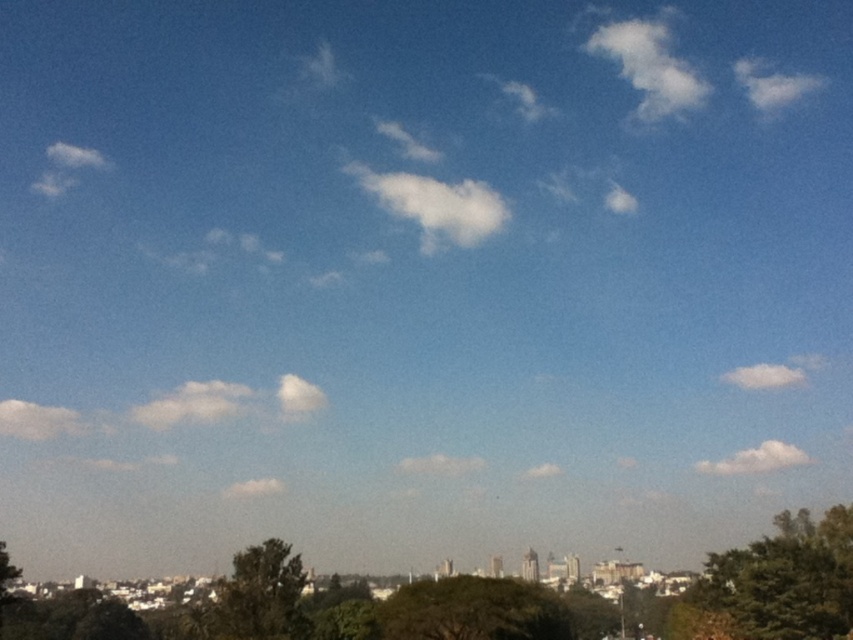
You are standing in the cityscape scene and notice a point marked at coordinates (x=775, y=584). Based on the scene description, can you identify what object this point is located on?

The point at coordinates (x=775, y=584) is located on the green textured tree at lower right.

In the scene shown: You are standing in the city park and see the green leafy tree at center and the green leafy tree at lower center. Which tree is taller?

The green leafy tree at lower center is taller than the green leafy tree at center.

You are a city planner assessing a park layout. You see the green textured tree at lower right and the green leafy tree at lower center. Which tree should you consider for shade provision if you need a larger canopy?

The green textured tree at lower right is bigger than the green leafy tree at lower center, so it should be considered for shade provision due to its larger canopy.